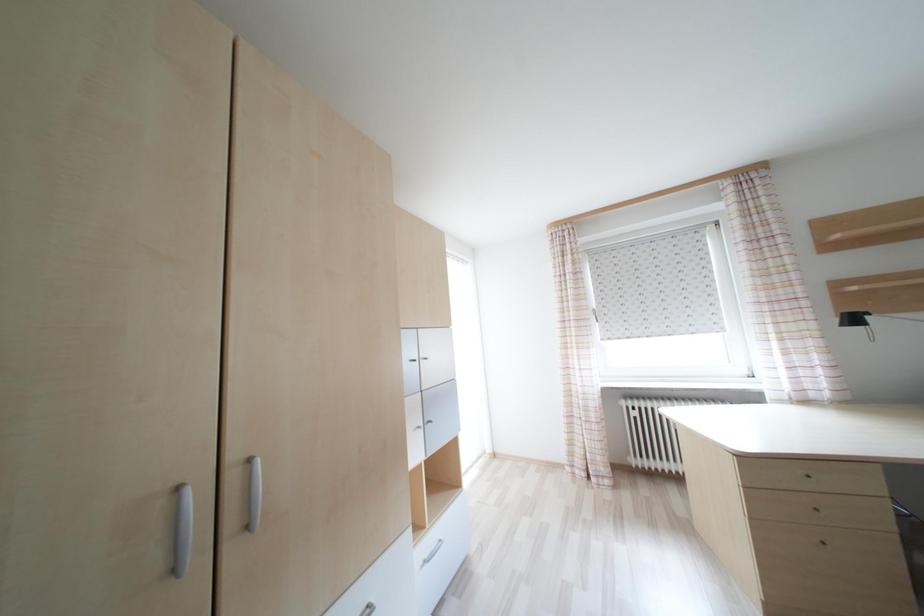
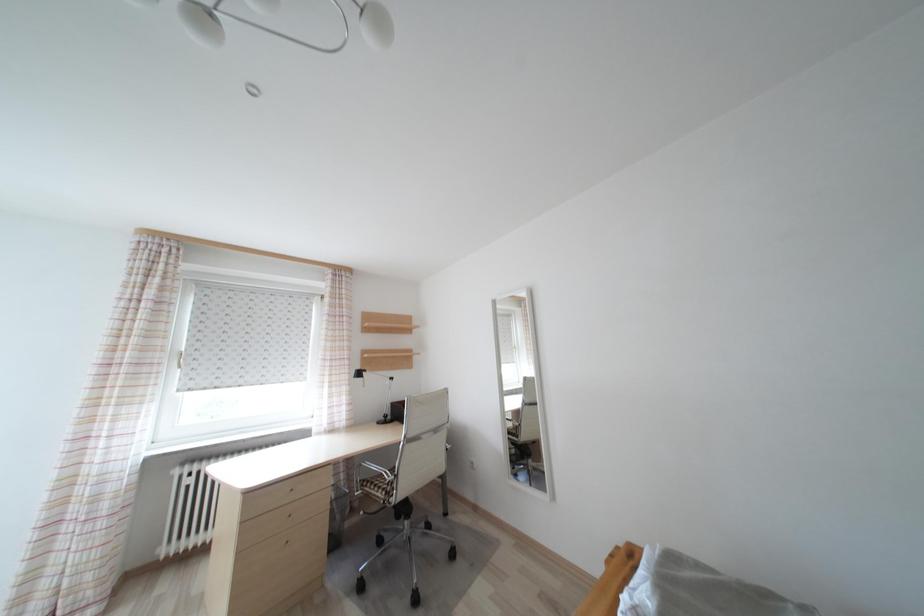
Question: The images are taken continuously from a first-person perspective. In which direction is your viewpoint rotating?

Choices:
 (A) Left
 (B) Right
 (C) Up
 (D) Down

Answer: (B)